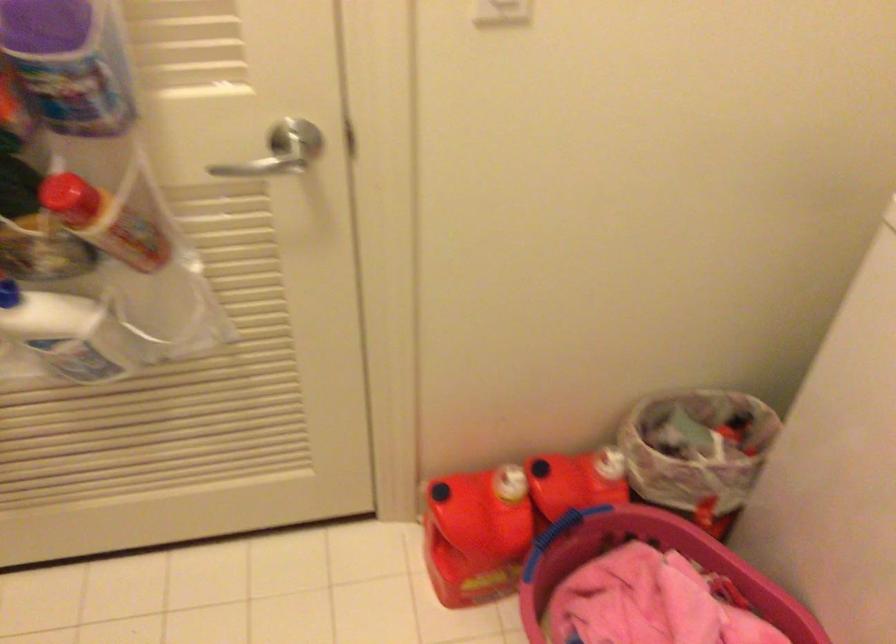
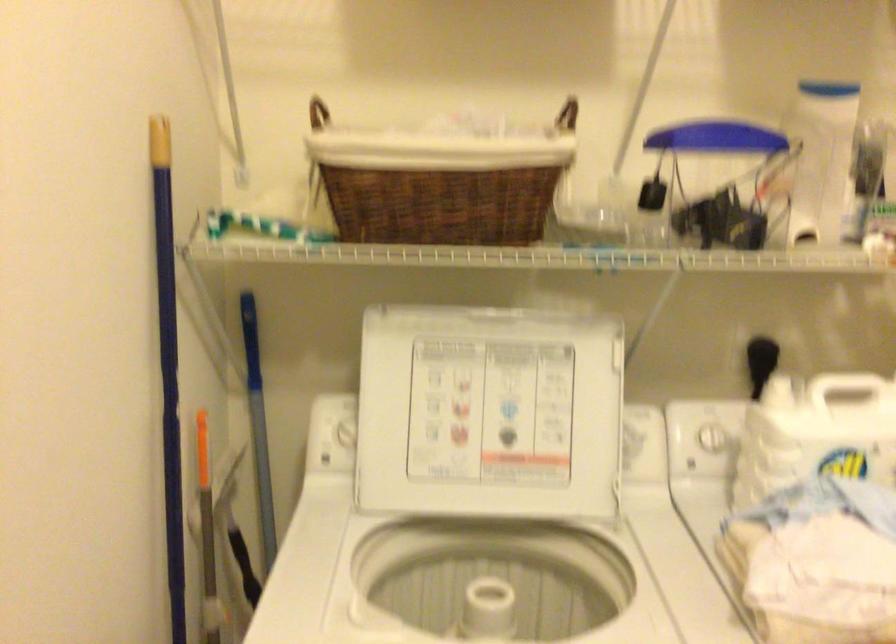
Question: Based on the continuous images, in which direction is the camera rotating? Reply with the corresponding letter.

Choices:
 (A) Left
 (B) Right
 (C) Up
 (D) Down

Answer: (B)